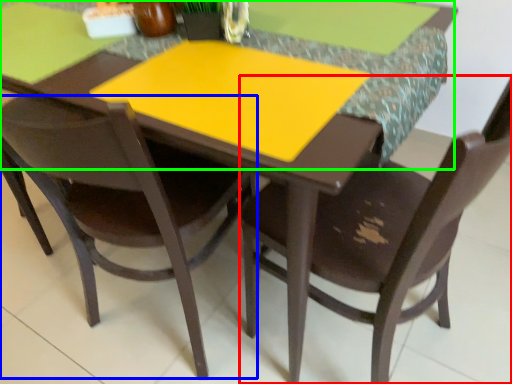
Question: Based on their relative distances, which object is nearer to chair (highlighted by a red box)? Choose from chair (highlighted by a blue box) and counter top (highlighted by a green box).

Choices:
 (A) chair
 (B) counter top

Answer: (B)